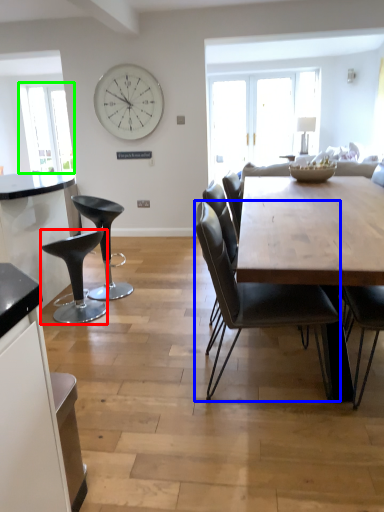
Question: Based on their relative distances, which object is farther from stool (highlighted by a red box)? Choose from chair (highlighted by a blue box) and window screen (highlighted by a green box).

Choices:
 (A) chair
 (B) window screen

Answer: (B)